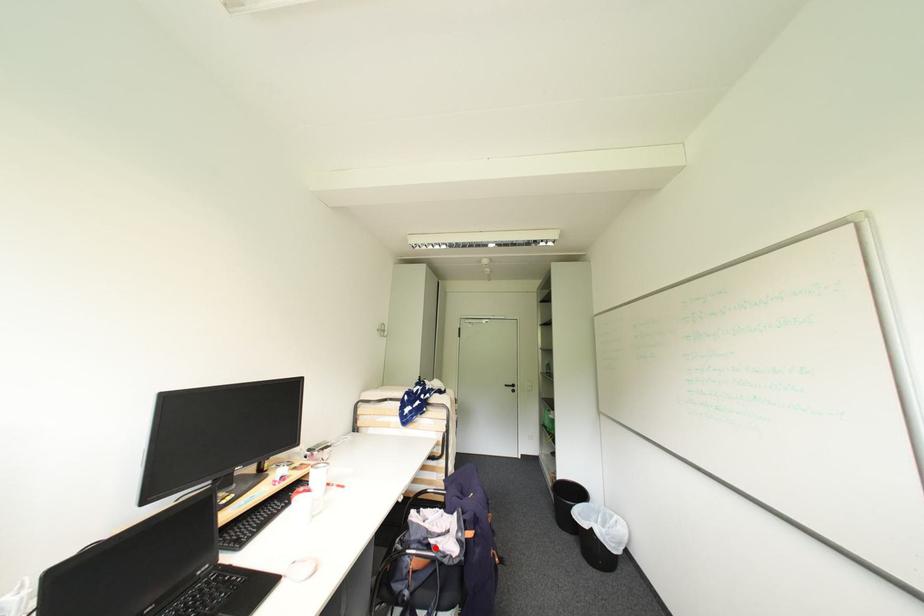
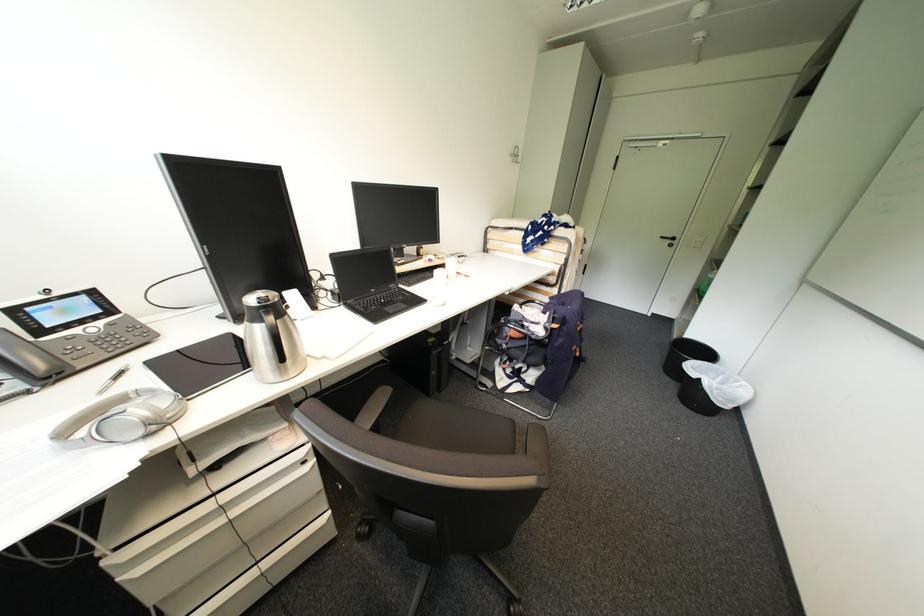
Locate, in the second image, the point that corresponds to the highlighted location in the first image.

(529, 326)